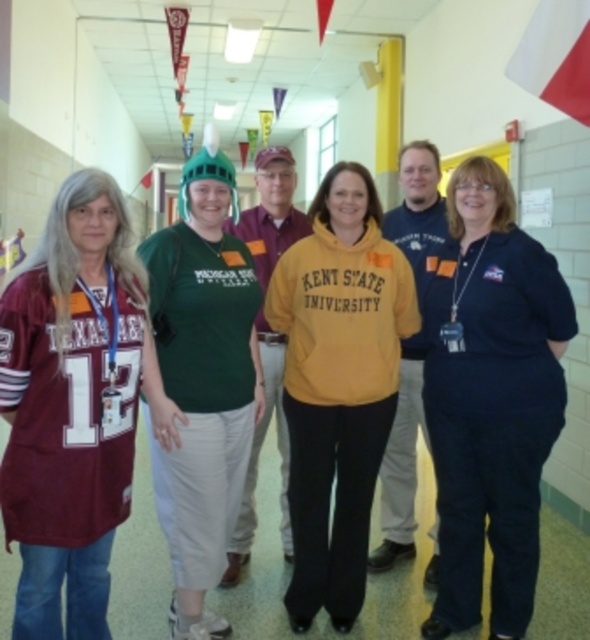
Can you confirm if navy blue uniform at center is wider than white fabric flag at upper right?

Correct, the width of navy blue uniform at center exceeds that of white fabric flag at upper right.

Does navy blue uniform at center appear on the right side of white fabric flag at upper right?

In fact, navy blue uniform at center is to the left of white fabric flag at upper right.

Between point (437, 349) and point (571, 24), which one is positioned in front?

Point (437, 349) is more forward.

This screenshot has width=590, height=640. I want to click on navy blue uniform at center, so click(x=490, y=400).

Is the position of yellow fleece sweatshirt at center less distant than that of green matte helmet at center?

No, it is not.

Between yellow fleece sweatshirt at center and green matte helmet at center, which one appears on the right side from the viewer's perspective?

From the viewer's perspective, yellow fleece sweatshirt at center appears more on the right side.

Which is behind, point (408, 292) or point (178, 496)?

The point (408, 292) is behind.

Find the location of a particular element. yellow fleece sweatshirt at center is located at coordinates (337, 385).

Does maroon jersey at left lie in front of white fabric flag at upper right?

Yes, it is.

Describe the element at coordinates (73, 404) in the screenshot. I see `maroon jersey at left` at that location.

Which is in front, point (54, 346) or point (575, 22)?

Point (54, 346)

This screenshot has width=590, height=640. Identify the location of maroon jersey at left. click(x=73, y=404).